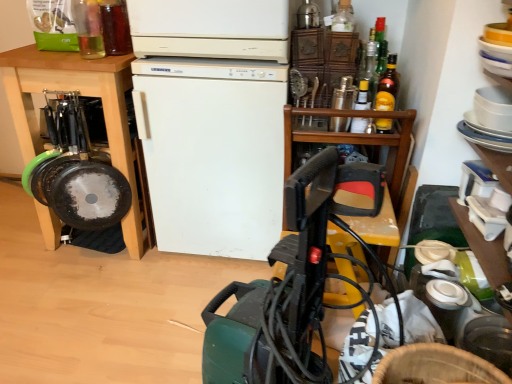
You are a GUI agent. You are given a task and a screenshot of the screen. Output one action in this format:
    pyautogui.click(x=<x>, y=<y>)
    Task: Click on the free location in front of white matte refrigerator at center
    Image resolution: width=512 pixels, height=384 pixels.
    Given the screenshot: What is the action you would take?
    pyautogui.click(x=163, y=310)